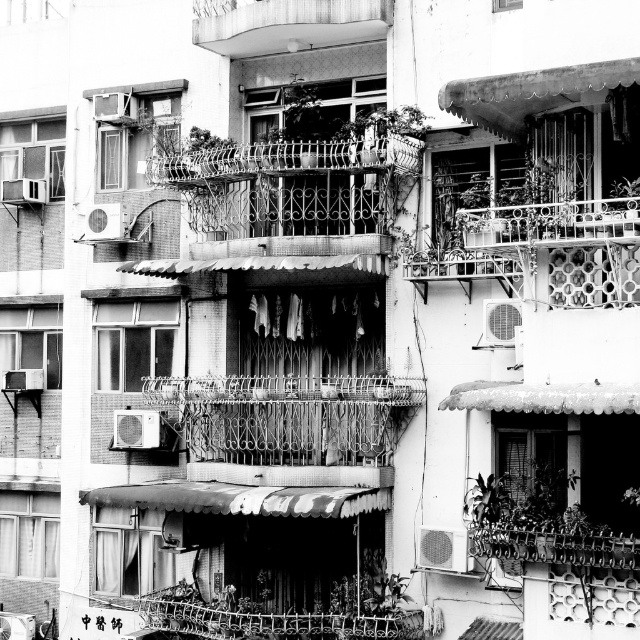
Question: Among these points, which one is farthest from the camera?

Choices:
 (A) 163,182
 (B) 38,179
 (C) 252,45
 (D) 548,230

Answer: (B)

Question: Which point is farther from the camera taking this photo?

Choices:
 (A) (301, 49)
 (B) (538, 216)

Answer: (A)

Question: Which object is positioned closest to the metallic air conditioner at upper left?

Choices:
 (A) wrought iron balcony at center
 (B) rusty metal balcony at upper right
 (C) metallic balcony at upper center

Answer: (C)

Question: Is rusty metal balcony at upper right positioned behind metallic air conditioner at upper left?

Choices:
 (A) yes
 (B) no

Answer: (B)

Question: Can you confirm if metallic balcony at upper center is positioned below rusty metal balcony at upper right?

Choices:
 (A) no
 (B) yes

Answer: (A)

Question: Is metallic balcony at upper center closer to the viewer compared to metallic air conditioner at upper left?

Choices:
 (A) yes
 (B) no

Answer: (A)